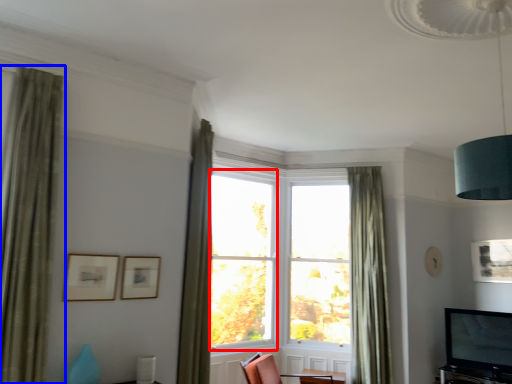
Question: Which object appears closest to the camera in this image, window (highlighted by a red box) or curtain (highlighted by a blue box)?

Choices:
 (A) window
 (B) curtain

Answer: (B)